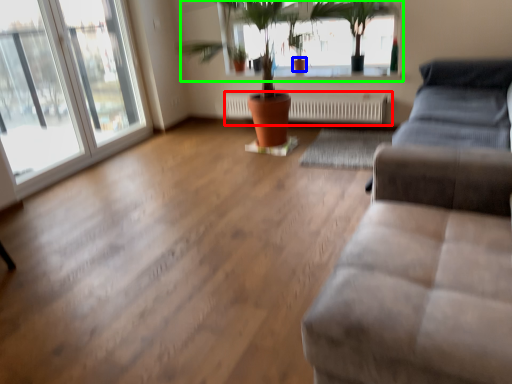
Question: Based on their relative distances, which object is nearer to radiator (highlighted by a red box)? Choose from flowerpot (highlighted by a blue box) and bay window (highlighted by a green box).

Choices:
 (A) flowerpot
 (B) bay window

Answer: (B)